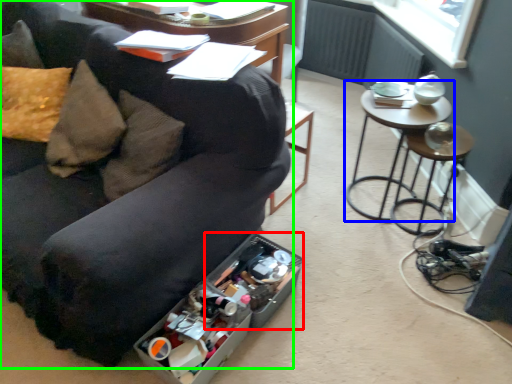
Question: Which is farther away from storage box (highlighted by a red box)? table (highlighted by a blue box) or studio couch (highlighted by a green box)?

Choices:
 (A) table
 (B) studio couch

Answer: (A)